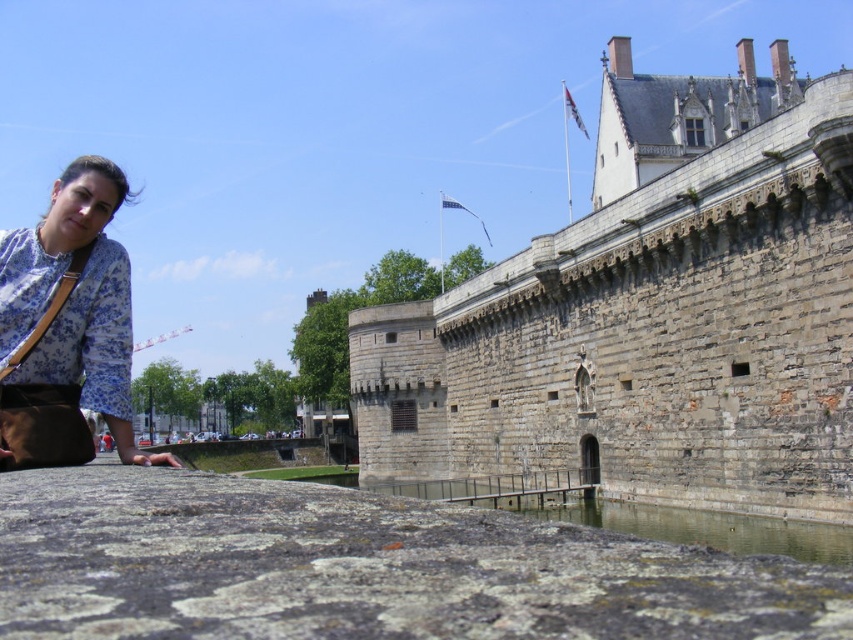
You are a tourist standing in front of the gray stone castle at upper center and the floral fabric blouse at lower left. Which object is located to the right when facing the scene?

The gray stone castle at upper center is positioned on the right side of the floral fabric blouse at lower left, so it is located to the right when facing the scene.